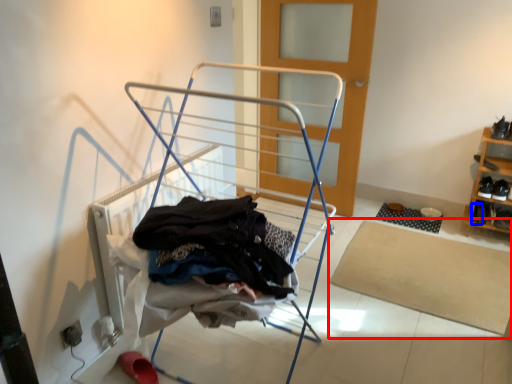
Question: Which point is closer to the camera, mat (highlighted by a red box) or shoe (highlighted by a blue box)?

Choices:
 (A) mat
 (B) shoe

Answer: (A)